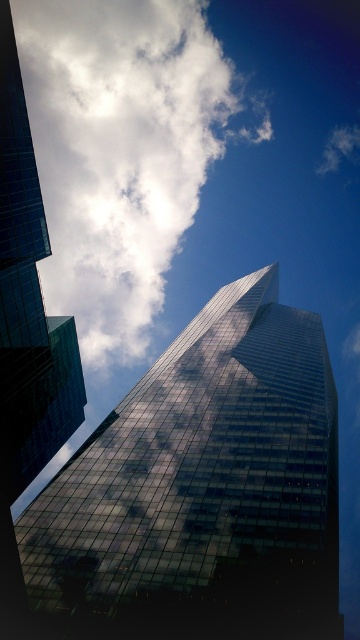
Can you confirm if reflective glass skyscraper at center is thinner than white fluffy cloud at upper center?

Yes, reflective glass skyscraper at center is thinner than white fluffy cloud at upper center.

Does point (99, 577) come closer to viewer compared to point (146, 250)?

That is True.

This screenshot has height=640, width=360. Describe the element at coordinates (204, 484) in the screenshot. I see `reflective glass skyscraper at center` at that location.

Image resolution: width=360 pixels, height=640 pixels. In order to click on reflective glass skyscraper at center in this screenshot , I will do `click(204, 484)`.

Which is in front, point (99, 353) or point (14, 76)?

Point (14, 76) is more forward.

Between white fluffy cloud at upper center and glassy reflective skyscraper at left, which one is positioned lower?

glassy reflective skyscraper at left

The width and height of the screenshot is (360, 640). Describe the element at coordinates (119, 150) in the screenshot. I see `white fluffy cloud at upper center` at that location.

The height and width of the screenshot is (640, 360). I want to click on white fluffy cloud at upper center, so click(119, 150).

Is point (235, 470) closer to camera compared to point (54, 422)?

Yes, point (235, 470) is closer to viewer.

Locate an element on the screen. This screenshot has width=360, height=640. reflective glass skyscraper at center is located at coordinates (204, 484).